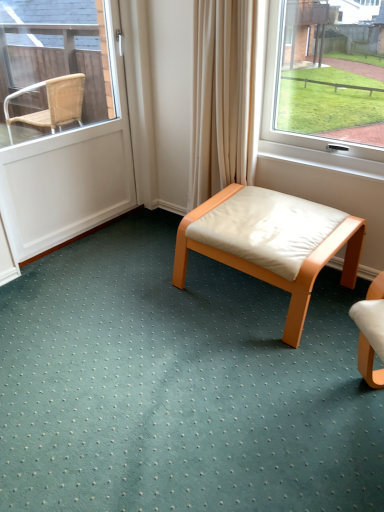
Question: Considering the relative sizes of white matte door at left and light brown wood stool at center in the image provided, is white matte door at left taller than light brown wood stool at center?

Choices:
 (A) no
 (B) yes

Answer: (B)

Question: Are white matte door at left and light brown wood stool at center far apart?

Choices:
 (A) no
 (B) yes

Answer: (B)

Question: Is white matte door at left facing away from light brown wood stool at center?

Choices:
 (A) no
 (B) yes

Answer: (A)

Question: Is the position of white matte door at left more distant than that of light brown wood stool at center?

Choices:
 (A) no
 (B) yes

Answer: (B)

Question: From the image's perspective, is white matte door at left below light brown wood stool at center?

Choices:
 (A) yes
 (B) no

Answer: (B)

Question: Is white matte door at left closer to camera compared to light brown wood stool at center?

Choices:
 (A) no
 (B) yes

Answer: (A)

Question: From a real-world perspective, is light brown wood stool at center on top of white matte door at left?

Choices:
 (A) yes
 (B) no

Answer: (B)

Question: Does light brown wood stool at center appear on the left side of white matte door at left?

Choices:
 (A) no
 (B) yes

Answer: (A)

Question: Does light brown wood stool at center have a lesser width compared to white matte door at left?

Choices:
 (A) yes
 (B) no

Answer: (B)

Question: Is light brown wood stool at center positioned in front of white matte door at left?

Choices:
 (A) no
 (B) yes

Answer: (B)

Question: Considering the relative sizes of light brown wood stool at center and white matte door at left in the image provided, is light brown wood stool at center smaller than white matte door at left?

Choices:
 (A) no
 (B) yes

Answer: (A)

Question: Is light brown wood stool at center bigger than white matte door at left?

Choices:
 (A) yes
 (B) no

Answer: (A)

Question: From the image's perspective, is light brown wood stool at center positioned above or below white matte door at left?

Choices:
 (A) above
 (B) below

Answer: (B)